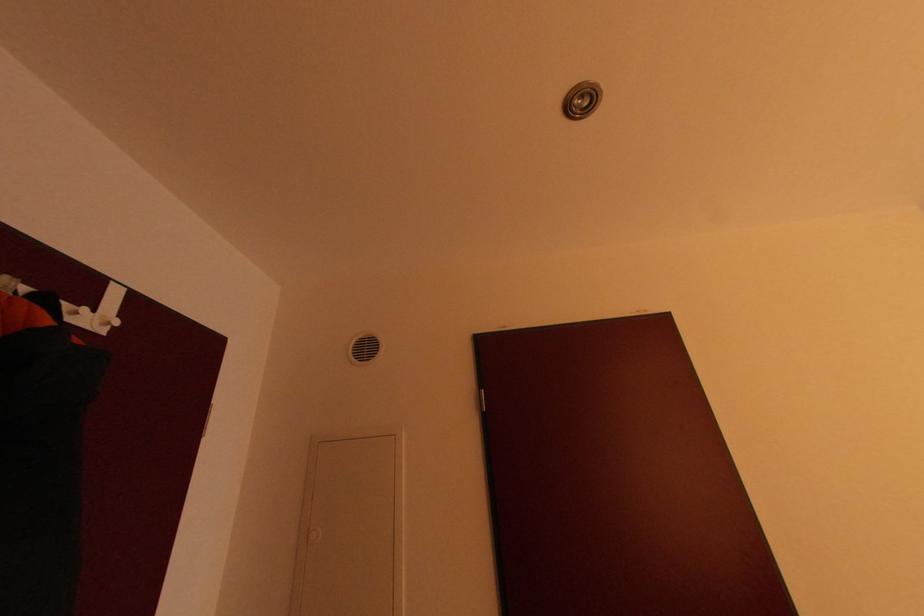
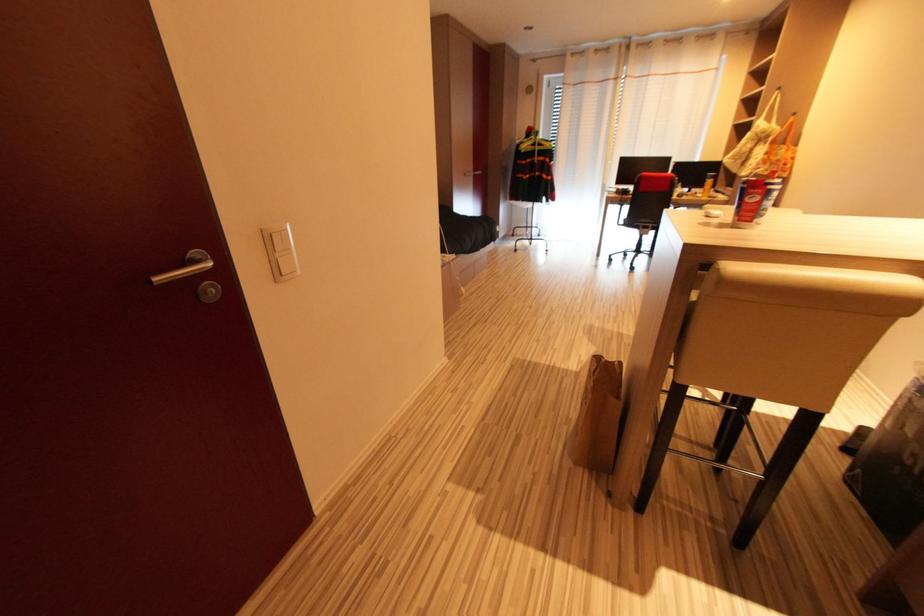
Looking at this image, first-person continuous shooting, in which direction is the camera rotating?

The rotation direction of the camera is right-down.